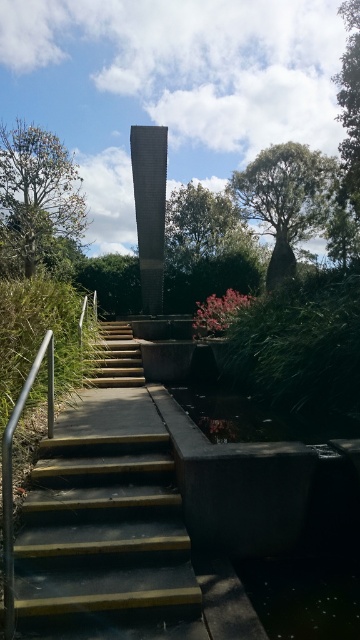
Question: Observing the image, what is the correct spatial positioning of dark gray concrete stairs at center in reference to polished metal handrail at left?

Choices:
 (A) below
 (B) above

Answer: (A)

Question: Which object is the farthest from the dark gray concrete stairs at center?

Choices:
 (A) yellow wood stairs at center
 (B) polished metal handrail at left

Answer: (A)

Question: Which object is positioned closest to the dark gray concrete stairs at center?

Choices:
 (A) polished metal handrail at left
 (B) yellow wood stairs at center

Answer: (A)

Question: Does polished metal handrail at left appear over yellow wood stairs at center?

Choices:
 (A) yes
 (B) no

Answer: (B)

Question: Can you confirm if dark gray concrete stairs at center is wider than polished metal handrail at left?

Choices:
 (A) no
 (B) yes

Answer: (B)

Question: Which of the following is the farthest from the observer?

Choices:
 (A) yellow wood stairs at center
 (B) dark gray concrete stairs at center

Answer: (A)